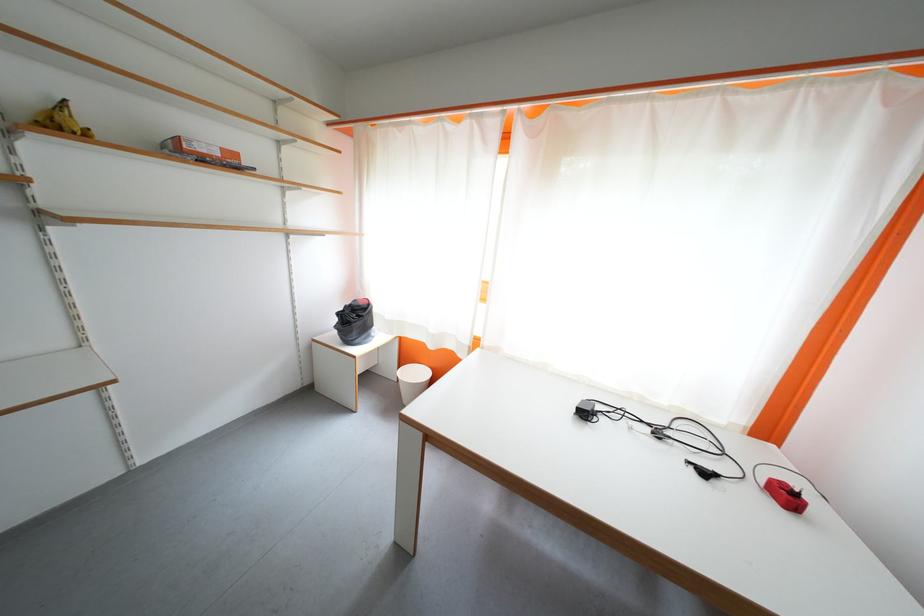
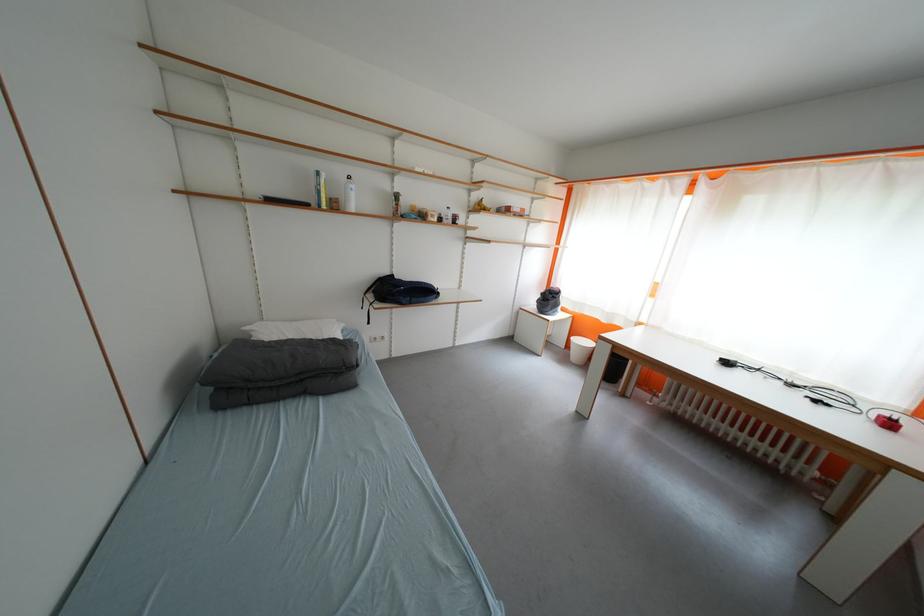
Where in the second image is the point corresponding to (347,317) from the first image?

(551, 297)